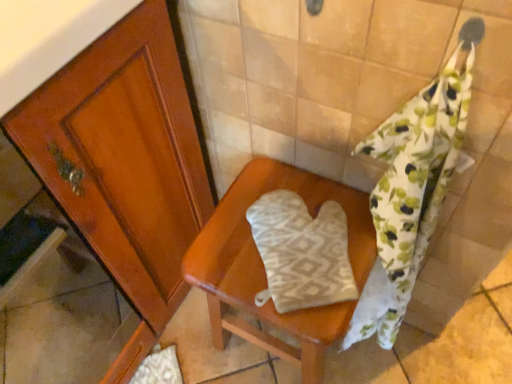
This screenshot has width=512, height=384. In order to click on empty space that is ontop of white textured oven mitt at center (from a real-world perspective) in this screenshot , I will do `click(302, 240)`.